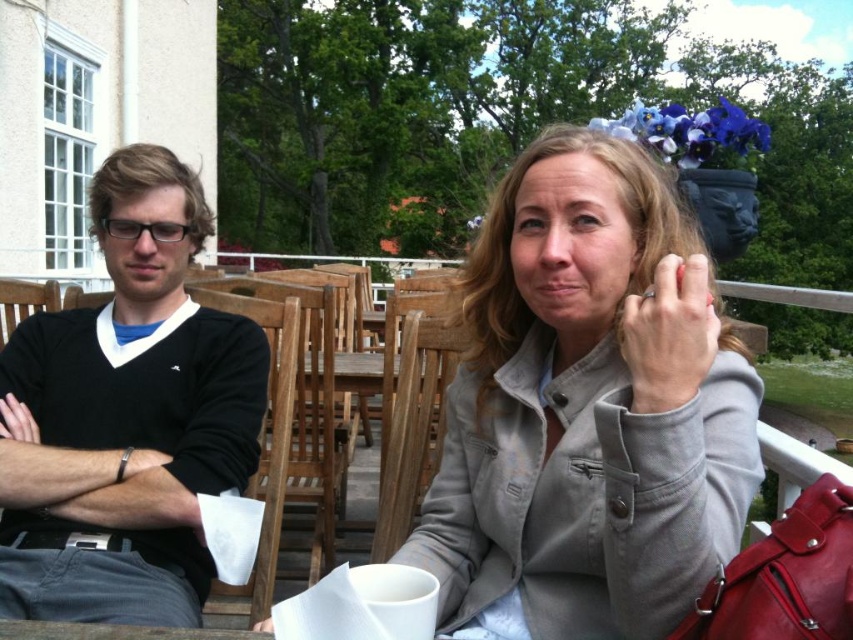
Question: Which point appears closest to the camera in this image?

Choices:
 (A) (670, 324)
 (B) (161, 291)

Answer: (A)

Question: Can you confirm if silver metallic ring at upper right is positioned below matte black hand at left?

Choices:
 (A) no
 (B) yes

Answer: (A)

Question: Estimate the real-world distances between objects in this image. Which object is farther from the gray matte jacket at center?

Choices:
 (A) silver metallic ring at upper right
 (B) wooden table at center
 (C) black sweater at left

Answer: (B)

Question: Is black sweater at left smaller than matte black hand at left?

Choices:
 (A) yes
 (B) no

Answer: (B)

Question: Which point is farther from the camera taking this photo?

Choices:
 (A) (373, 364)
 (B) (15, 406)
 (C) (120, 196)

Answer: (A)

Question: Can you confirm if black sweater at left is smaller than silver metallic ring at upper right?

Choices:
 (A) no
 (B) yes

Answer: (A)